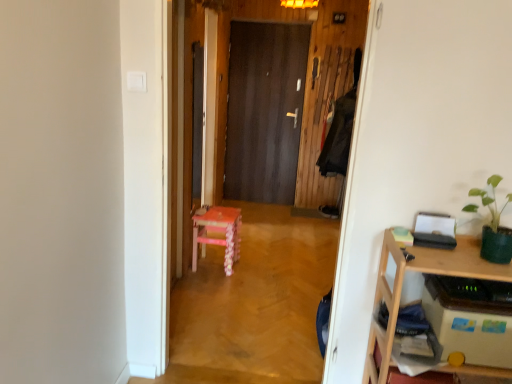
Question: From the image's perspective, relative to dark wood door at center, is pink wood chair at center above or below?

Choices:
 (A) below
 (B) above

Answer: (A)

Question: Visually, is pink wood chair at center positioned to the left or to the right of dark wood door at center?

Choices:
 (A) left
 (B) right

Answer: (A)

Question: Considering the real-world distances, which object is farthest from the pink wood chair at center?

Choices:
 (A) dark wood door at center
 (B) green matte plant at upper right
 (C) wooden desk at right
 (D) pink wood stool at center

Answer: (B)

Question: Which is nearer to the pink wood stool at center?

Choices:
 (A) dark wood door at center
 (B) pink wood chair at center
 (C) wooden desk at right
 (D) green matte plant at upper right

Answer: (B)